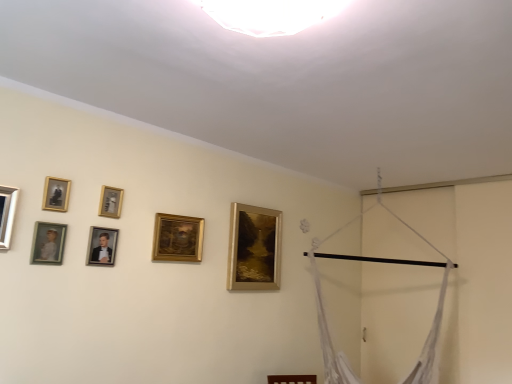
Question: Considering the relative sizes of matte gold picture frame at left, marked as the sixth picture frame in a back-to-front arrangement, and matte silver picture frame at left, acting as the 1th picture frame starting from the front, in the image provided, is matte gold picture frame at left, marked as the sixth picture frame in a back-to-front arrangement, bigger than matte silver picture frame at left, acting as the 1th picture frame starting from the front,?

Choices:
 (A) yes
 (B) no

Answer: (B)

Question: Is matte gold picture frame at left, the 6th picture frame in the right-to-left sequence, to the right of matte silver picture frame at left, placed as the seventh picture frame when sorted from right to left, from the viewer's perspective?

Choices:
 (A) yes
 (B) no

Answer: (A)

Question: Is matte gold picture frame at left, the 6th picture frame in the right-to-left sequence, next to matte silver picture frame at left, acting as the 1th picture frame starting from the front?

Choices:
 (A) no
 (B) yes

Answer: (A)

Question: Is matte gold picture frame at left, the 6th picture frame in the right-to-left sequence, shorter than matte silver picture frame at left, acting as the first picture frame starting from the left?

Choices:
 (A) no
 (B) yes

Answer: (B)

Question: Would you say matte gold picture frame at left, marked as the sixth picture frame in a back-to-front arrangement, is outside matte silver picture frame at left, acting as the 1th picture frame starting from the front?

Choices:
 (A) no
 (B) yes

Answer: (B)

Question: Relative to gold metallic picture frame at upper center, the 3th picture frame viewed from the right, is gold-framed portrait at upper left, the third picture frame viewed from the front, in front or behind?

Choices:
 (A) behind
 (B) front

Answer: (B)

Question: From the image's perspective, is gold-framed portrait at upper left, marked as the 5th picture frame in a right-to-left arrangement, above or below gold metallic picture frame at upper center, marked as the fifth picture frame in a front-to-back arrangement?

Choices:
 (A) below
 (B) above

Answer: (B)

Question: Is gold-framed portrait at upper left, marked as the 5th picture frame in a right-to-left arrangement, situated inside gold metallic picture frame at upper center, which is the 3th picture frame in back-to-front order, or outside?

Choices:
 (A) outside
 (B) inside

Answer: (A)

Question: Visually, is gold-framed portrait at upper left, marked as the 5th picture frame in a right-to-left arrangement, positioned to the left or to the right of gold metallic picture frame at upper center, the 3th picture frame viewed from the right?

Choices:
 (A) left
 (B) right

Answer: (A)

Question: From a real-world perspective, relative to gold-framed portrait at upper left, marked as the 5th picture frame in a right-to-left arrangement, is gold metallic picture frame at upper center, marked as the fifth picture frame in a front-to-back arrangement, vertically above or below?

Choices:
 (A) below
 (B) above

Answer: (B)

Question: In terms of height, does gold metallic picture frame at upper center, the 3th picture frame viewed from the right, look taller or shorter compared to gold-framed portrait at upper left, the third picture frame viewed from the front?

Choices:
 (A) short
 (B) tall

Answer: (A)

Question: In terms of width, does gold metallic picture frame at upper center, which is the 3th picture frame in back-to-front order, look wider or thinner when compared to gold-framed portrait at upper left, marked as the 5th picture frame in a right-to-left arrangement?

Choices:
 (A) thin
 (B) wide

Answer: (B)

Question: Relative to gold-framed portrait at upper left, marked as the 5th picture frame in a right-to-left arrangement, is gold metallic picture frame at upper center, marked as the fifth picture frame in a front-to-back arrangement, in front or behind?

Choices:
 (A) front
 (B) behind

Answer: (B)

Question: Is gold metallic picture frame at upper center, which is counted as the fifth picture frame, starting from the left, in front of or behind matte gold picture frame at left, the 6th picture frame in the right-to-left sequence, in the image?

Choices:
 (A) front
 (B) behind

Answer: (B)

Question: Choose the correct answer: Is gold metallic picture frame at upper center, which is the 3th picture frame in back-to-front order, inside matte gold picture frame at left, which appears as the 2th picture frame when viewed from the front, or outside it?

Choices:
 (A) outside
 (B) inside

Answer: (A)